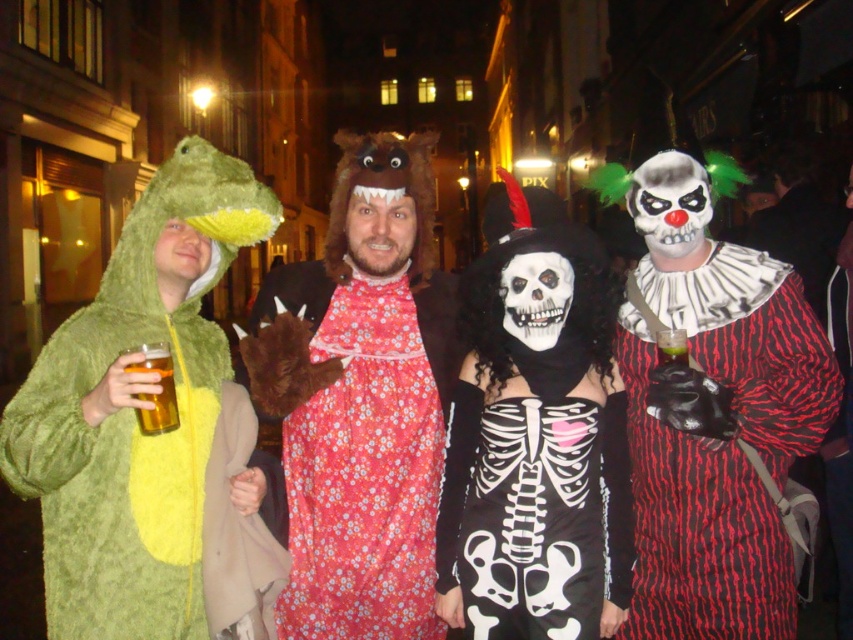
Does fluffy green dinosaur at left come behind translucent yellow liquid at lower left?

Yes, it is behind translucent yellow liquid at lower left.

Can you confirm if fluffy green dinosaur at left is positioned to the right of translucent yellow liquid at lower left?

No, fluffy green dinosaur at left is not to the right of translucent yellow liquid at lower left.

Who is more forward, (135, 451) or (161, 374)?

Point (161, 374) is more forward.

You are a GUI agent. You are given a task and a screenshot of the screen. Output one action in this format:
    pyautogui.click(x=<x>, y=<y>)
    Task: Click on the fluffy green dinosaur at left
    This screenshot has height=640, width=853.
    Given the screenshot: What is the action you would take?
    click(x=154, y=435)

Between floral fabric dress at center and translucent plastic cup at center, which one is positioned lower?

floral fabric dress at center is lower down.

Based on the photo, between floral fabric dress at center and translucent plastic cup at center, which one is positioned higher?

translucent plastic cup at center is above.

Which is in front, point (392, 378) or point (676, 362)?

Point (676, 362) is in front.

The height and width of the screenshot is (640, 853). In order to click on floral fabric dress at center in this screenshot , I will do `click(366, 456)`.

Who is more distant from viewer, (x=120, y=349) or (x=755, y=506)?

Point (x=755, y=506)

Does fluffy green dinosaur at left appear on the left side of red striped clown at right?

Indeed, fluffy green dinosaur at left is positioned on the left side of red striped clown at right.

Locate an element on the screen. The image size is (853, 640). fluffy green dinosaur at left is located at coordinates (154, 435).

Image resolution: width=853 pixels, height=640 pixels. Identify the location of fluffy green dinosaur at left. (154, 435).